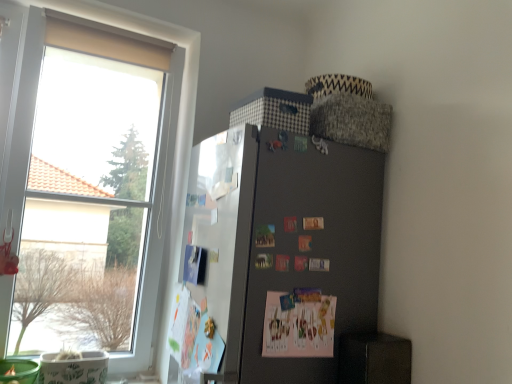
Question: Considering the positions of point (190, 336) and point (57, 160), is point (190, 336) closer or farther from the camera than point (57, 160)?

Choices:
 (A) farther
 (B) closer

Answer: (B)

Question: Would you say white paperboard at left is to the left or to the right of transparent glass window at left in the picture?

Choices:
 (A) right
 (B) left

Answer: (A)

Question: Which object is the closest to the satin black fridge at upper right?

Choices:
 (A) pink paper postcard at center
 (B) white paperboard at left
 (C) transparent glass window at left

Answer: (B)

Question: Estimate the real-world distances between objects in this image. Which object is farther from the pink paper postcard at center?

Choices:
 (A) satin black fridge at upper right
 (B) white paperboard at left
 (C) transparent glass window at left

Answer: (C)